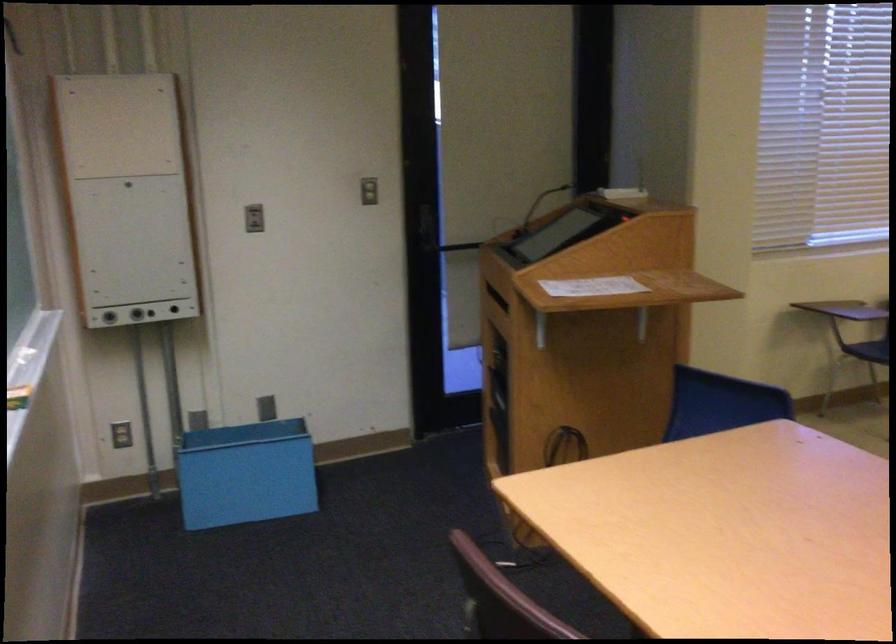
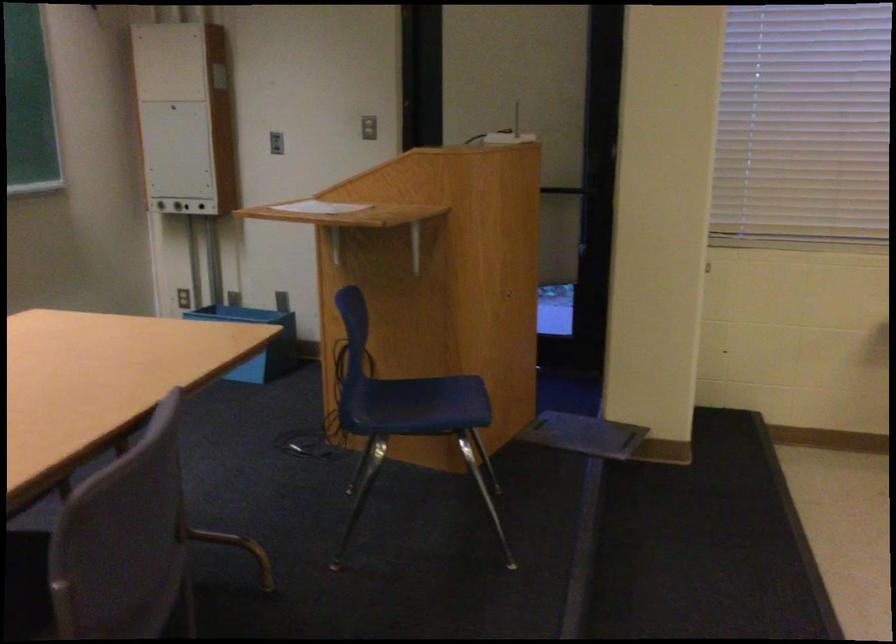
In the second image, find the point that corresponds to point (784, 431) in the first image.

(256, 341)